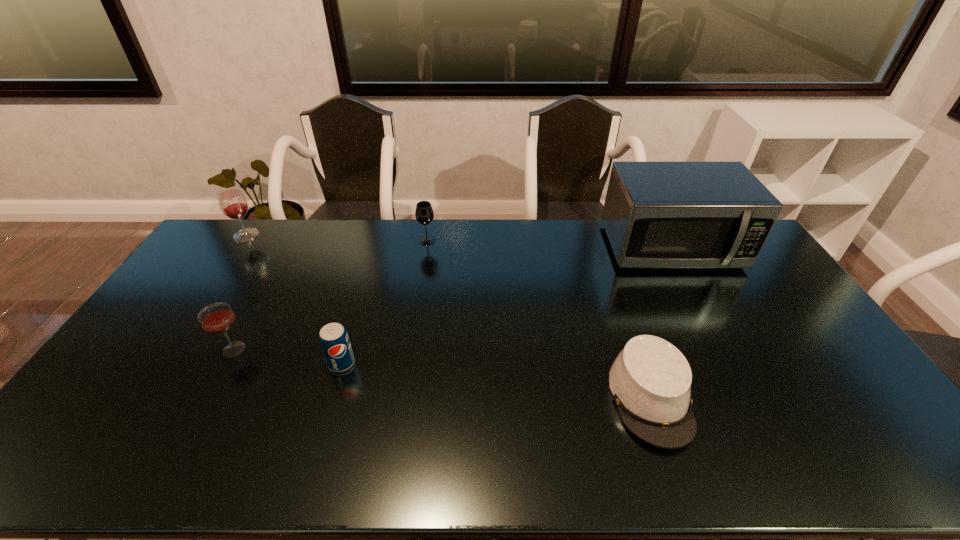
Locate an element on the screen. The image size is (960, 540). vacant space at the left edge is located at coordinates (184, 340).

Identify the location of vacant space at the right edge of the desktop. The width and height of the screenshot is (960, 540). click(883, 425).

At what (x,y) coordinates should I click in order to perform the action: click on free space between the hat and the second wineglass from left to right. Please return your answer as a coordinate pair (x, y). Image resolution: width=960 pixels, height=540 pixels. Looking at the image, I should click on (443, 374).

Locate an element on the screen. The image size is (960, 540). vacant space that is in between the pop and the shortest object is located at coordinates (496, 381).

Find the location of `empty space between the hat and the tallest object`. empty space between the hat and the tallest object is located at coordinates (660, 322).

Image resolution: width=960 pixels, height=540 pixels. Identify the location of free area in between the leftmost wineglass and the shortest object. (448, 316).

The image size is (960, 540). I want to click on unoccupied area between the nearest wineglass and the leftmost object, so click(x=240, y=292).

Where is `free spot between the rightmost wineglass and the tallest object`? free spot between the rightmost wineglass and the tallest object is located at coordinates (549, 244).

Find the location of a particular element. This screenshot has width=960, height=540. vacant area that lies between the second object from left to right and the leftmost wineglass is located at coordinates (240, 292).

Find the location of a particular element. free space between the second object from left to right and the shortest object is located at coordinates (443, 374).